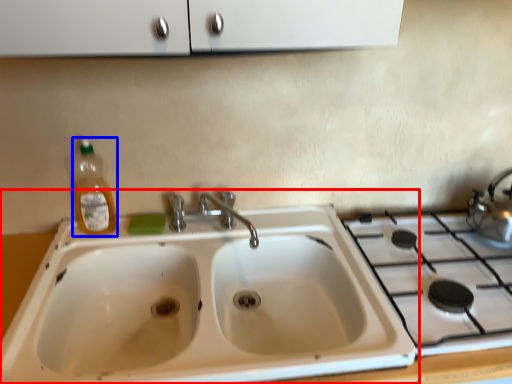
Question: Which object is closer to the camera taking this photo, sink (highlighted by a red box) or bottle (highlighted by a blue box)?

Choices:
 (A) sink
 (B) bottle

Answer: (A)